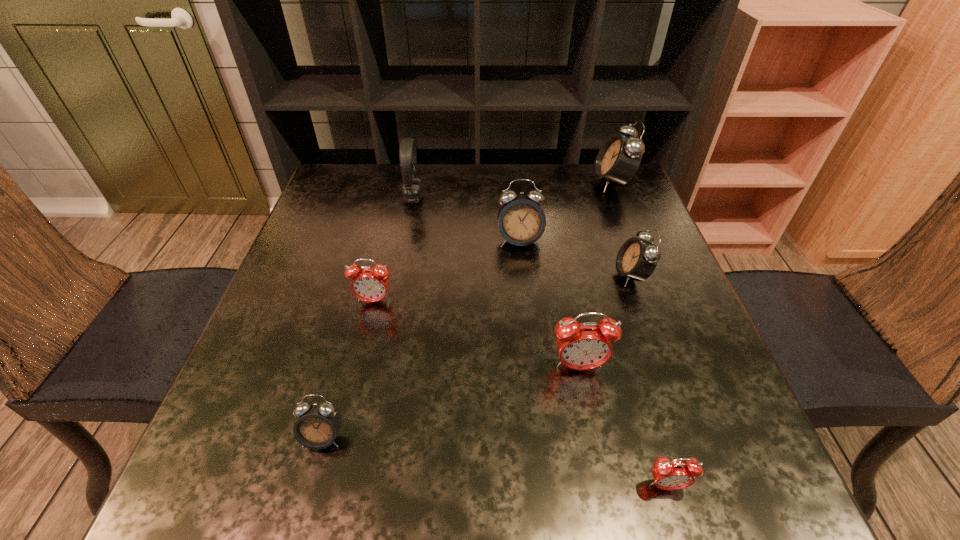
Locate an element on the screen. Image resolution: width=960 pixels, height=540 pixels. the leftmost red alarm clock is located at coordinates (368, 284).

The height and width of the screenshot is (540, 960). What are the coordinates of `the nearest white alarm clock` in the screenshot? It's located at (318, 423).

The image size is (960, 540). Identify the location of the second nearest alarm clock. (318, 423).

This screenshot has width=960, height=540. What are the coordinates of `the rightmost red alarm clock` in the screenshot? It's located at (676, 474).

Identify the location of the nearest red alarm clock. The image size is (960, 540). (676, 474).

Locate an element on the screen. The width and height of the screenshot is (960, 540). vacant region located on the face of the farthest alarm clock is located at coordinates (492, 183).

Where is `vacant point located on the face of the farthest alarm clock`? This screenshot has height=540, width=960. vacant point located on the face of the farthest alarm clock is located at coordinates (562, 183).

The width and height of the screenshot is (960, 540). Identify the location of vacant area located on the face of the farthest alarm clock. (457, 183).

I want to click on vacant region located 0.190m on the front-facing side of the headset, so click(x=492, y=198).

Where is `vacant space located 0.290m on the face of the second farthest alarm clock`? vacant space located 0.290m on the face of the second farthest alarm clock is located at coordinates (531, 352).